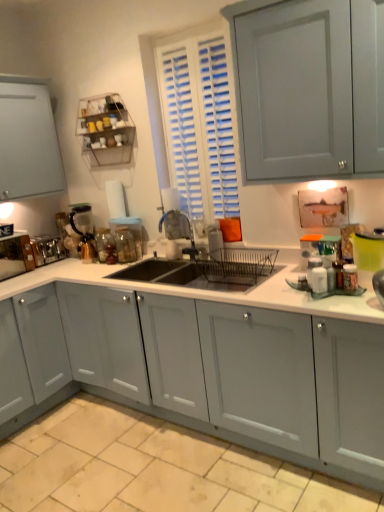
Question: From the image's perspective, is clear glass jar at sink, placed as the fourth appliance when sorted from left to right, positioned above or below metallic silver toaster at left, the first appliance when ordered from left to right?

Choices:
 (A) above
 (B) below

Answer: (A)

Question: Is clear glass jar at sink, placed as the fourth appliance when sorted from left to right, inside the boundaries of metallic silver toaster at left, the fourth appliance from the right, or outside?

Choices:
 (A) outside
 (B) inside

Answer: (A)

Question: Which object is positioned farthest from the satin silver toaster at left, which is the 3th appliance from right to left?

Choices:
 (A) metallic blue faucet at center
 (B) metal wire rack at upper left
 (C) white matte countertop at center
 (D) metallic silver toaster at left, the first appliance when ordered from left to right
 (E) clear glass jar at sink, the 1th appliance when ordered from right to left

Answer: (C)

Question: Estimate the real-world distances between objects in this image. Which object is farther from the clear glass jar at sink, the 1th appliance when ordered from right to left?

Choices:
 (A) metal wire rack at upper left
 (B) white matte countertop at center
 (C) satin silver toaster at left, which is the 3th appliance from right to left
 (D) metallic blue faucet at center
 (E) metallic silver toaster at left, the first appliance when ordered from left to right

Answer: (B)